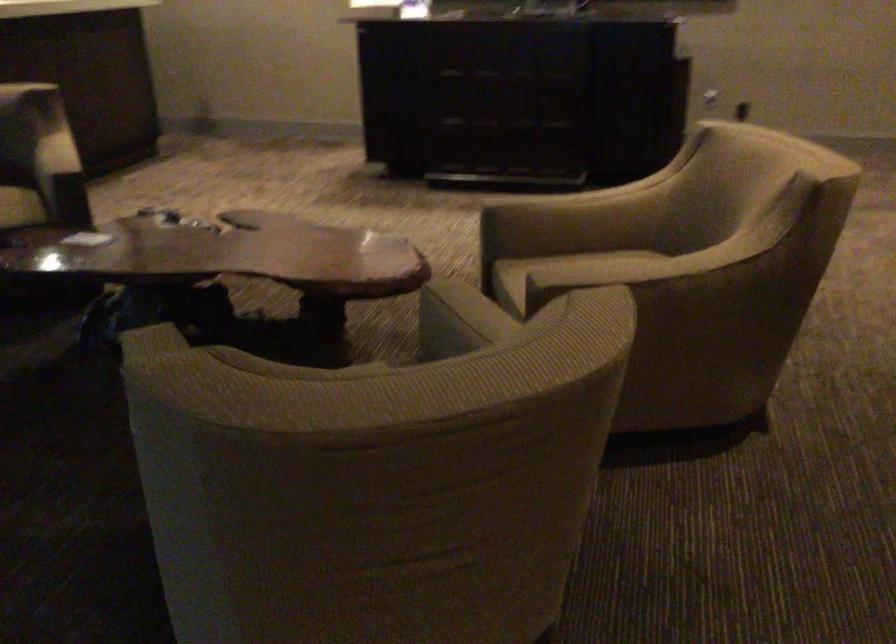
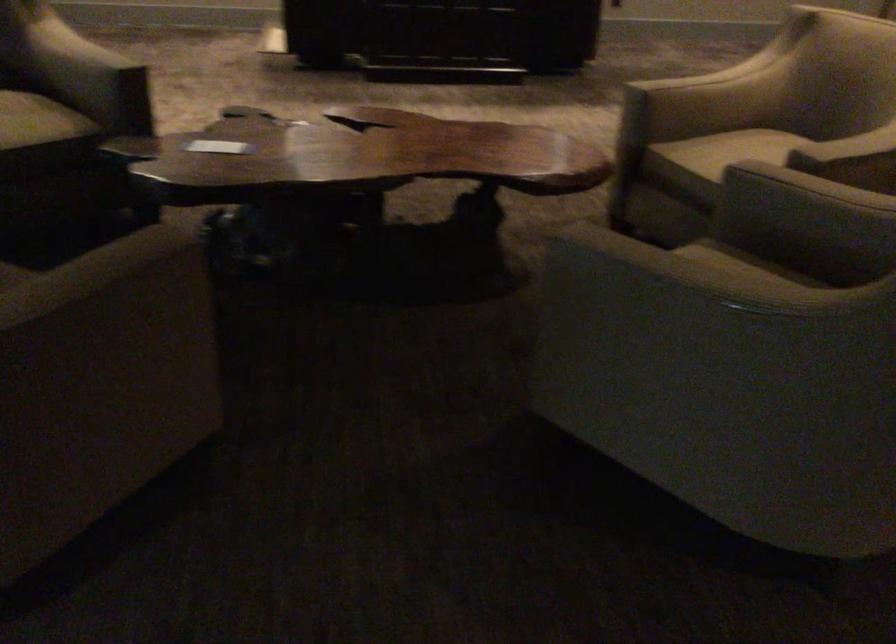
Where in the second image is the point corresponding to (x=76, y=234) from the first image?

(218, 146)